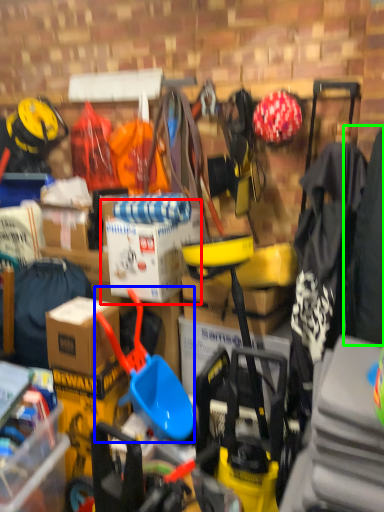
Question: Which object is the closest to the cardboard box (highlighted by a red box)? Choose among these: shovel (highlighted by a blue box) or clothing (highlighted by a green box).

Choices:
 (A) shovel
 (B) clothing

Answer: (A)